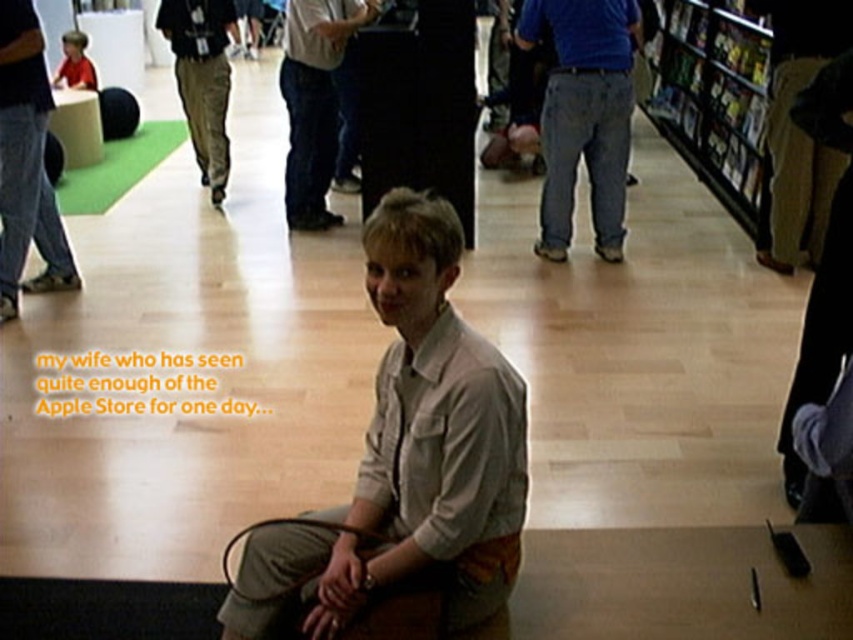
Who is more distant from viewer, (444, 374) or (563, 193)?

Positioned behind is point (563, 193).

Who is more distant from viewer, (433, 545) or (569, 124)?

Point (569, 124)

What are the coordinates of `light beige shirt at center` in the screenshot? It's located at (408, 452).

Who is more forward, (289, 218) or (158, 20)?

Point (289, 218) is more forward.

Which is behind, point (288, 108) or point (206, 88)?

Positioned behind is point (206, 88).

Identify the location of light gray shirt at center. (314, 100).

Does denim pants at left have a smaller size compared to matte red shirt at upper left?

No.

Between denim pants at left and matte red shirt at upper left, which one appears on the left side from the viewer's perspective?

From the viewer's perspective, matte red shirt at upper left appears more on the left side.

Which is behind, point (10, 216) or point (67, 58)?

The point (67, 58) is behind.

You are a GUI agent. You are given a task and a screenshot of the screen. Output one action in this format:
    pyautogui.click(x=<x>, y=<y>)
    Task: Click on the denim pants at left
    
    Given the screenshot: What is the action you would take?
    pyautogui.click(x=26, y=163)